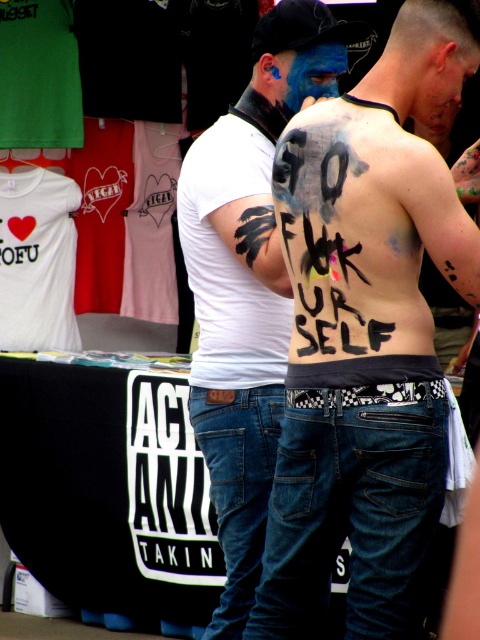
You are a photographer trying to capture the entire message on the black paint text at back and the denim jeans at lower center in a single frame. Based on the scene description, which object should you focus on first to ensure both are fully visible?

The black paint text at back might be wider than denim jeans at lower center, so you should focus on the black paint text at back first to ensure both are fully visible.